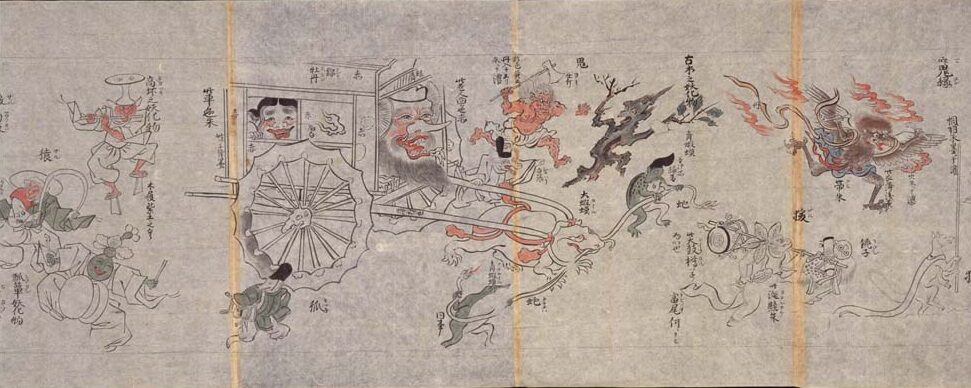
Identify the location of asian art. The width and height of the screenshot is (971, 388). (270, 126).